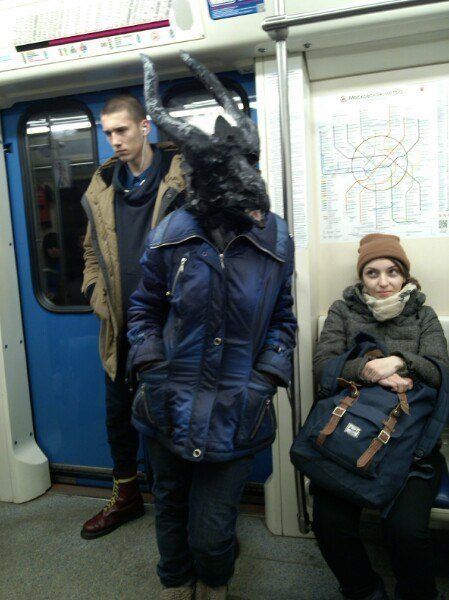
I want to click on white walls, so click(328, 83).